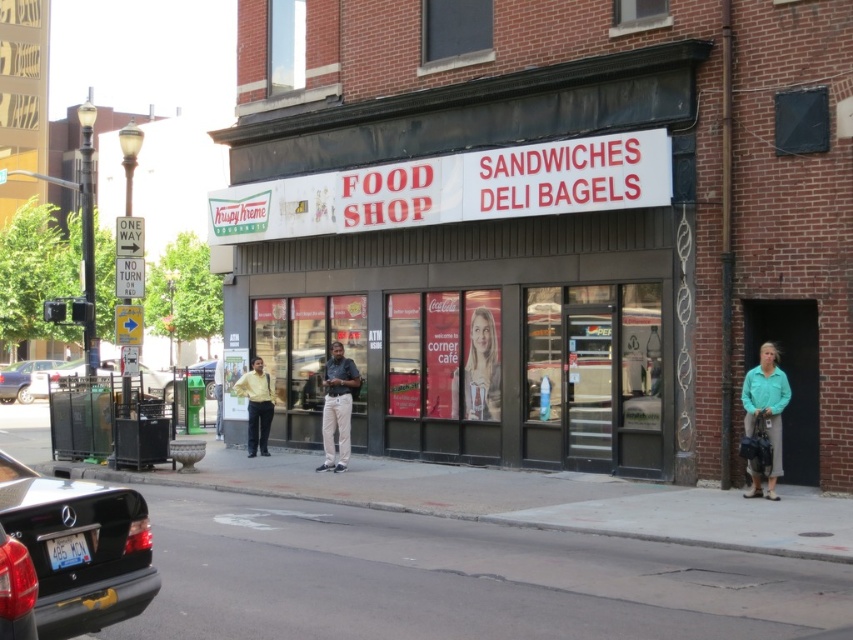
You are standing on the sidewalk in front of the food shop and notice a person wearing a yellow matte shirt at center. Based on the coordinates provided in the description, can you determine if the shirt is positioned closer to the entrance or the decorative metal railing on the right side of the entrance?

The yellow matte shirt at center is located at point coordinates, so it is positioned closer to the entrance than the decorative metal railing on the right side of the entrance.

You are standing on the sidewalk in front of the food shop and notice a yellow matte shirt at center and a metallic silver car at center. Which object is nearer to you?

The yellow matte shirt at center is closer to the viewer than the metallic silver car at center.